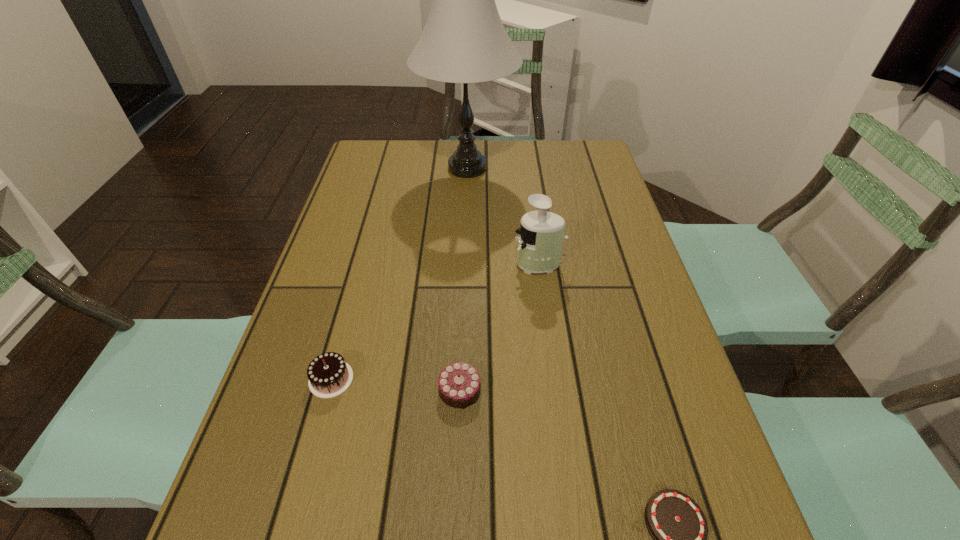
Identify the location of free space in the image that satisfies the following two spatial constraints: 1. on the back side of the lamp; 2. on the left side of the leftmost object. The height and width of the screenshot is (540, 960). (389, 168).

The width and height of the screenshot is (960, 540). Identify the location of free location that satisfies the following two spatial constraints: 1. on the back side of the second farthest object; 2. on the right side of the second tallest chocolate cake. (465, 264).

This screenshot has width=960, height=540. What are the coordinates of `free space that satisfies the following two spatial constraints: 1. on the front side of the second tallest chocolate cake; 2. on the left side of the tallest object` in the screenshot? It's located at (459, 390).